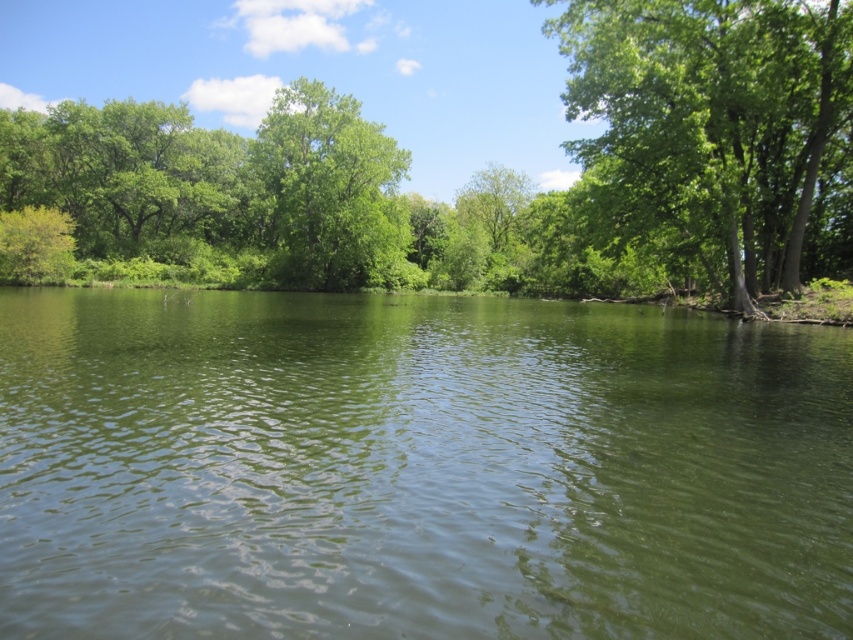
Does green smooth water at center have a greater height compared to green leafy tree at center?

No.

Between green smooth water at center and green leafy tree at center, which one appears on the left side from the viewer's perspective?

green leafy tree at center is more to the left.

Is point (717, 628) more distant than point (292, 198)?

No, it is in front of (292, 198).

Locate an element on the screen. Image resolution: width=853 pixels, height=640 pixels. green smooth water at center is located at coordinates (416, 468).

Which is behind, point (688, 262) or point (386, 259)?

The point (386, 259) is behind.

Does point (621, 179) come behind point (350, 97)?

No, (621, 179) is in front of (350, 97).

Is point (704, 218) positioned in front of point (318, 145)?

Yes, point (704, 218) is in front of point (318, 145).

Locate an element on the screen. green leafy tree at right is located at coordinates (715, 131).

Does point (201, 636) come behind point (659, 116)?

No, it is not.

Can you confirm if green smooth water at center is positioned to the right of green leafy tree at right?

Incorrect, green smooth water at center is not on the right side of green leafy tree at right.

Measure the distance between green smooth water at center and camera.

They are 4.68 meters apart.

At what (x,y) coordinates should I click in order to perform the action: click on green smooth water at center. Please return your answer as a coordinate pair (x, y). This screenshot has width=853, height=640. Looking at the image, I should click on tap(416, 468).